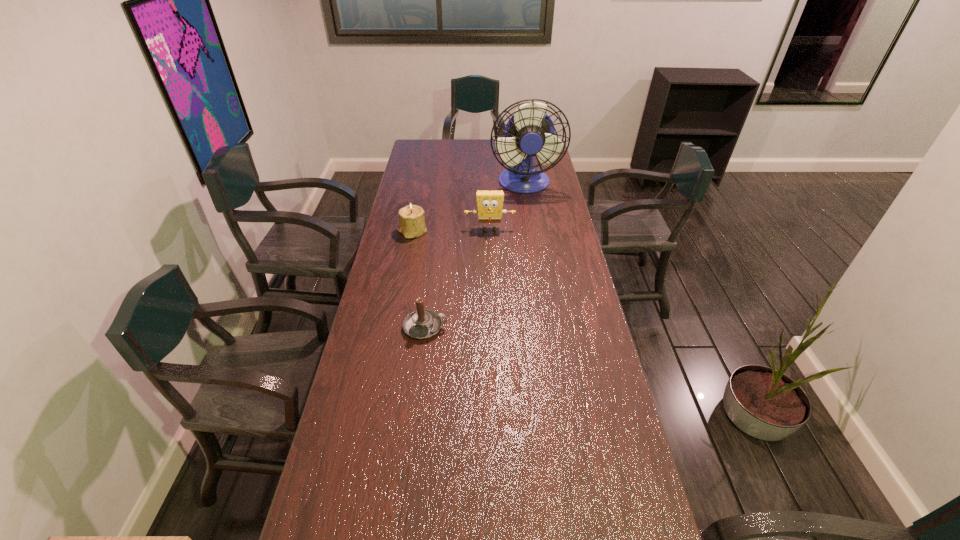
Where is `candle_holder situated at the left edge`? This screenshot has height=540, width=960. candle_holder situated at the left edge is located at coordinates (412, 224).

Locate an element on the screen. This screenshot has width=960, height=540. candle that is at the left edge is located at coordinates (421, 324).

Where is `object at the right edge`? The width and height of the screenshot is (960, 540). object at the right edge is located at coordinates (530, 132).

In the image, there is a desktop. Where is `vacant space at the far edge`? vacant space at the far edge is located at coordinates (475, 152).

The height and width of the screenshot is (540, 960). In the image, there is a desktop. What are the coordinates of `blank space at the left edge` in the screenshot? It's located at (411, 251).

In the image, there is a desktop. Identify the location of vacant space at the right edge. This screenshot has height=540, width=960. point(560,190).

I want to click on free spot at the far left corner of the desktop, so click(437, 146).

Identify the location of unoccupied position between the fan and the candle_holder. (468, 208).

I want to click on empty space that is in between the fan and the sponge, so pyautogui.click(x=507, y=207).

The image size is (960, 540). Identify the location of free space that is in between the tallest object and the nearest object. (475, 255).